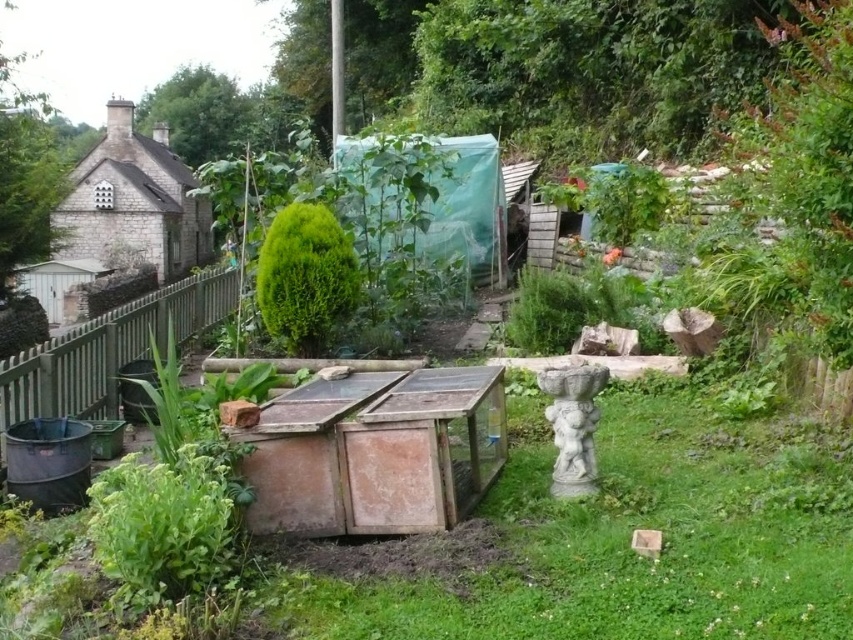
Is green wooden fence at lower left below green leafy bush at center?

Correct, green wooden fence at lower left is located below green leafy bush at center.

Measure the distance between green wooden fence at lower left and green leafy bush at center.

The distance of green wooden fence at lower left from green leafy bush at center is 1.43 meters.

Measure the distance between point (1,380) and camera.

A distance of 3.51 meters exists between point (1,380) and camera.

Locate an element on the screen. The image size is (853, 640). green wooden fence at lower left is located at coordinates (109, 349).